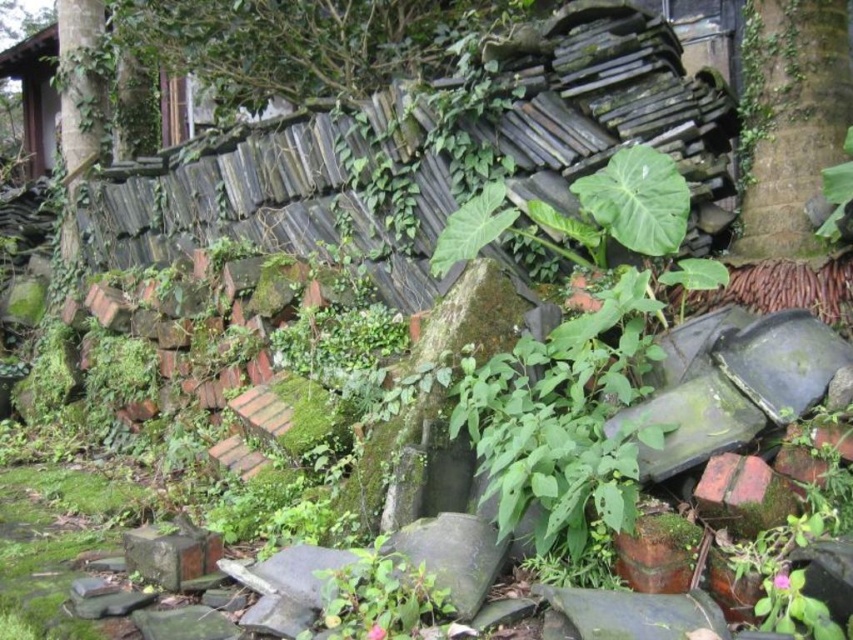
Does point (247, 49) lie in front of point (842, 76)?

No, (247, 49) is further to viewer.

Locate an element on the screen. green leafy tree at upper center is located at coordinates (306, 44).